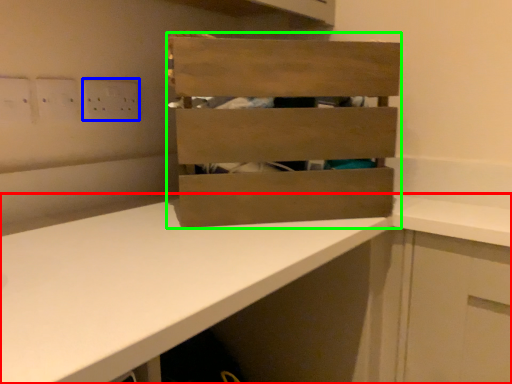
Question: Which object is the farthest from countertop (highlighted by a red box)? Choose among these: electric outlet (highlighted by a blue box) or crate (highlighted by a green box).

Choices:
 (A) electric outlet
 (B) crate

Answer: (A)